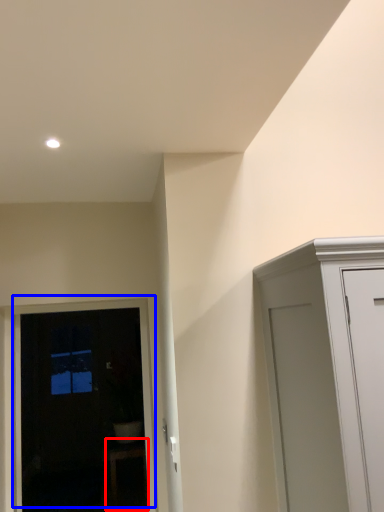
Question: Which of the following is the farthest to the observer, furniture (highlighted by a red box) or door (highlighted by a blue box)?

Choices:
 (A) furniture
 (B) door

Answer: (A)